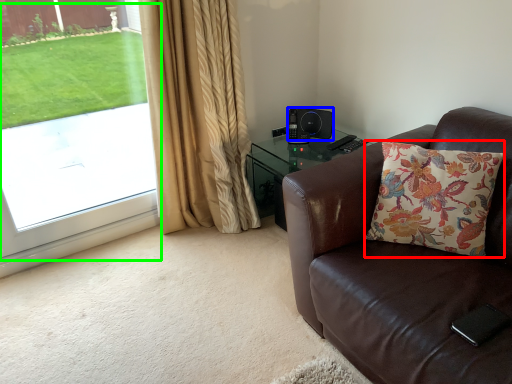
Question: Estimate the real-world distances between objects in this image. Which object is closer to pillow (highlighted by a red box), speaker (highlighted by a blue box) or window screen (highlighted by a green box)?

Choices:
 (A) speaker
 (B) window screen

Answer: (A)